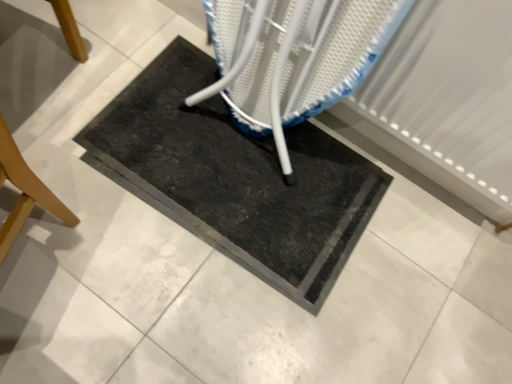
Identify the location of black rubber mat at center. (234, 177).

The image size is (512, 384). What do you see at coordinates (234, 177) in the screenshot? I see `black rubber mat at center` at bounding box center [234, 177].

The width and height of the screenshot is (512, 384). I want to click on black rubber mat at center, so click(x=234, y=177).